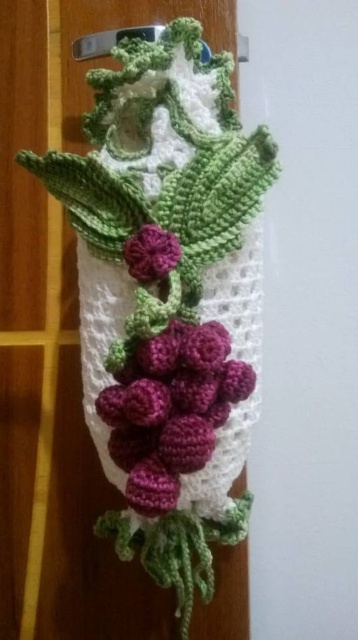
You are a store manager who wants to display the crochet scarf at center and the grape clusters in purple and magenta on a shelf. The shelf is 3 feet wide. Can both items fit side by side on the shelf without overlapping?

The crochet scarf at center and the grape clusters in purple and magenta are 36.85 inches apart. Since 36.85 inches is approximately 3.07 feet, which is slightly wider than the 3 feet shelf, they cannot fit side by side without overlapping.

You are an interior designer planning to hang the crocheted decorative piece on a wall. You need to ensure that the crochet scarf at center and the matte purple yarn grapes at center are visible from a distance. Which object will appear larger to someone standing across the room?

The crochet scarf at center will appear larger than the matte purple yarn grapes at center because it is bigger in size.

In the scene shown: You are hanging a decorative piece on your wall and notice the crochet scarf at center and the matte purple yarn grapes at center. Based on their positions, which one would be easier to see if you are standing directly in front of the wall?

The crochet scarf at center is located above the matte purple yarn grapes at center, so it would be easier to see since it is positioned higher up and not obstructed by the grapes below.